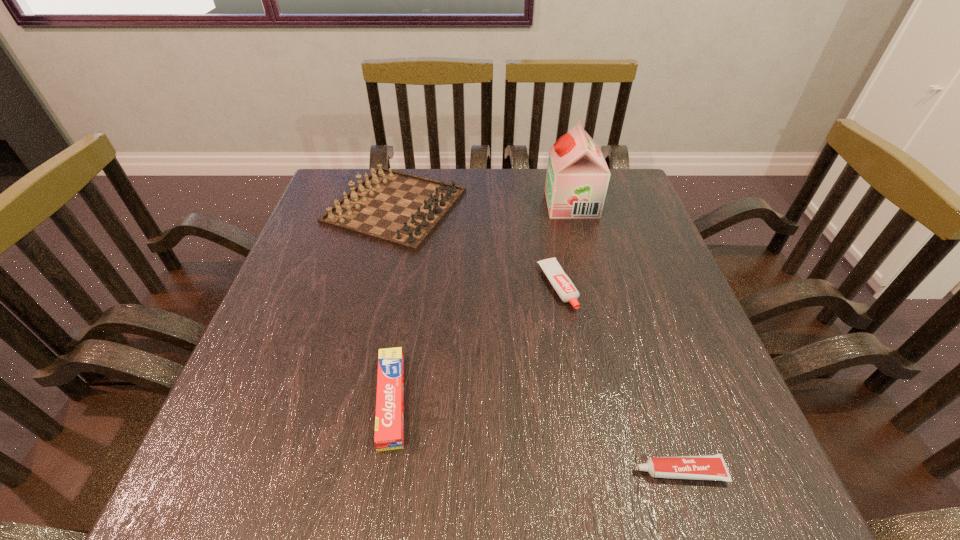
Identify the location of vacant space at the far right corner. (612, 196).

I want to click on free space between the fourth farthest object and the farthest toothpaste, so click(x=474, y=343).

Locate an element on the screen. This screenshot has height=540, width=960. free area in between the chessboard and the fourth farthest object is located at coordinates (394, 303).

Locate an element on the screen. free point between the fourth farthest object and the chessboard is located at coordinates (394, 303).

The image size is (960, 540). I want to click on free space between the second tallest object and the leftmost toothpaste, so click(x=394, y=303).

This screenshot has width=960, height=540. I want to click on free spot between the rightmost toothpaste and the second tallest object, so click(538, 339).

Image resolution: width=960 pixels, height=540 pixels. Identify the location of vacant space that's between the chessboard and the fourth farthest object. (394, 303).

You are a GUI agent. You are given a task and a screenshot of the screen. Output one action in this format:
    pyautogui.click(x=<x>, y=<y>)
    Task: Click on the vacant space in between the soya milk and the third farthest object
    
    Given the screenshot: What is the action you would take?
    pyautogui.click(x=564, y=245)

Locate an element on the screen. The height and width of the screenshot is (540, 960). free space between the chessboard and the rightmost toothpaste is located at coordinates (538, 339).

The height and width of the screenshot is (540, 960). In order to click on empty space between the tallest object and the third farthest object in this screenshot , I will do [564, 245].